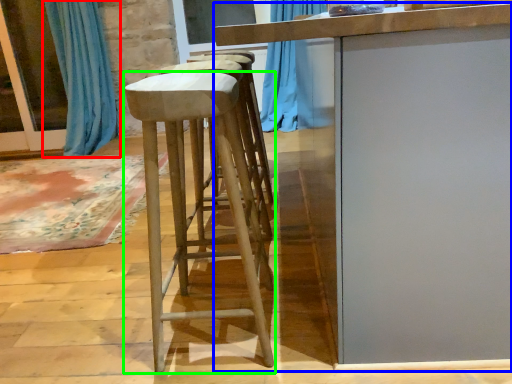
Question: Which object is positioned farthest from curtain (highlighted by a red box)? Select from table (highlighted by a blue box) and stool (highlighted by a green box).

Choices:
 (A) table
 (B) stool

Answer: (A)